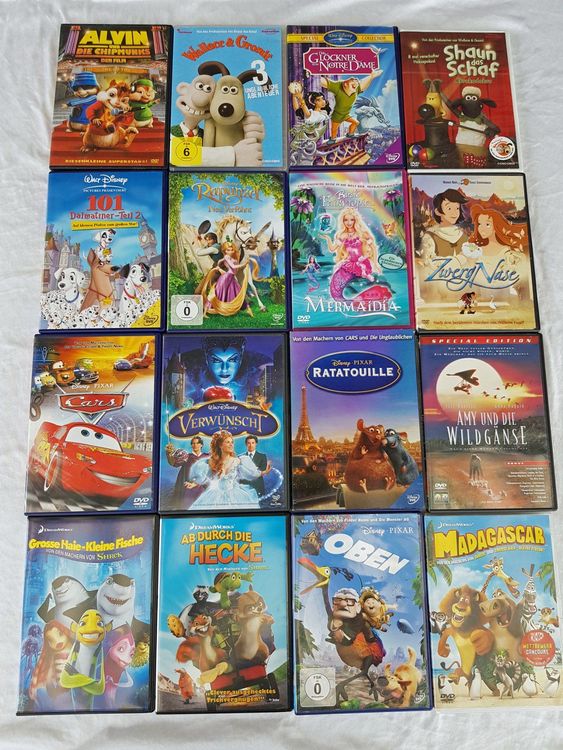
This screenshot has width=563, height=750. In order to click on bottom row of dvds in this screenshot , I will do `click(486, 626)`, `click(373, 626)`, `click(230, 604)`, `click(117, 609)`.